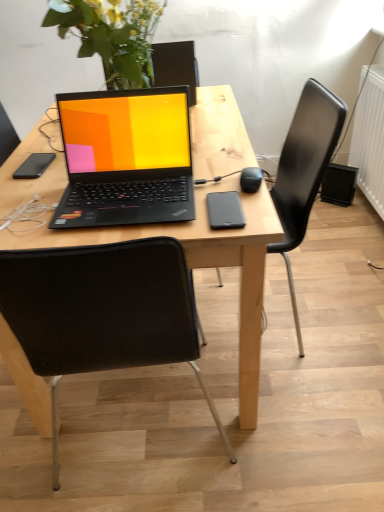
Find the location of `free area in between black matte computer mouse at center-right and black matte phone at center, the 2th mobile phone in the left-to-right sequence`. free area in between black matte computer mouse at center-right and black matte phone at center, the 2th mobile phone in the left-to-right sequence is located at coordinates (244, 196).